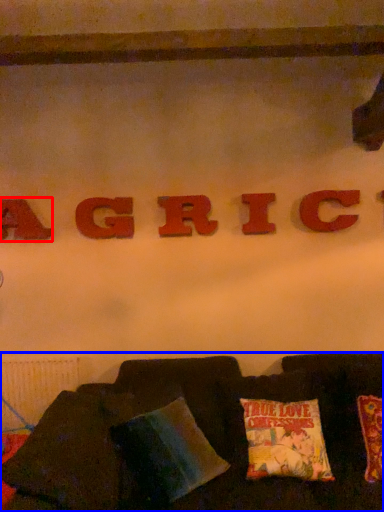
Question: Among these objects, which one is farthest to the camera, letter (highlighted by a red box) or furniture (highlighted by a blue box)?

Choices:
 (A) letter
 (B) furniture

Answer: (A)